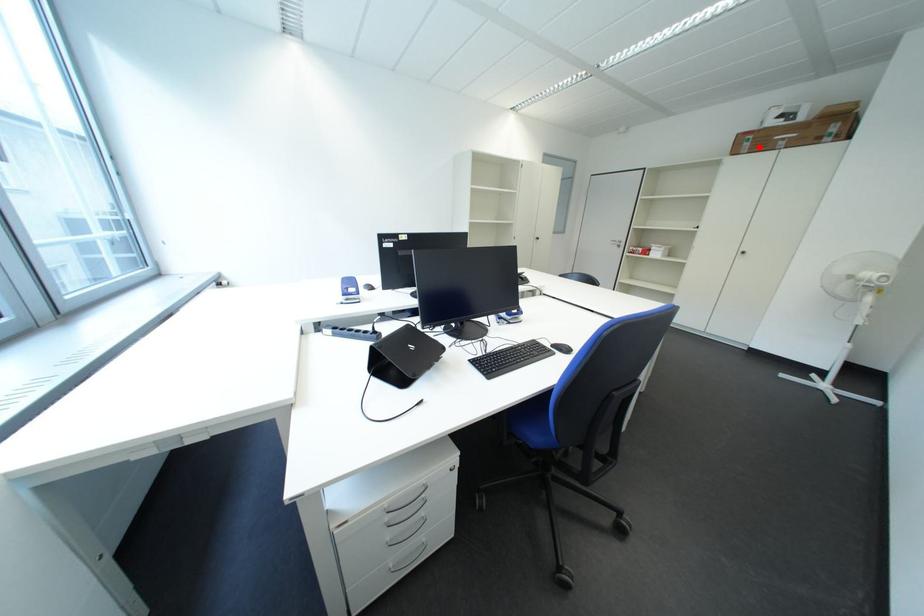
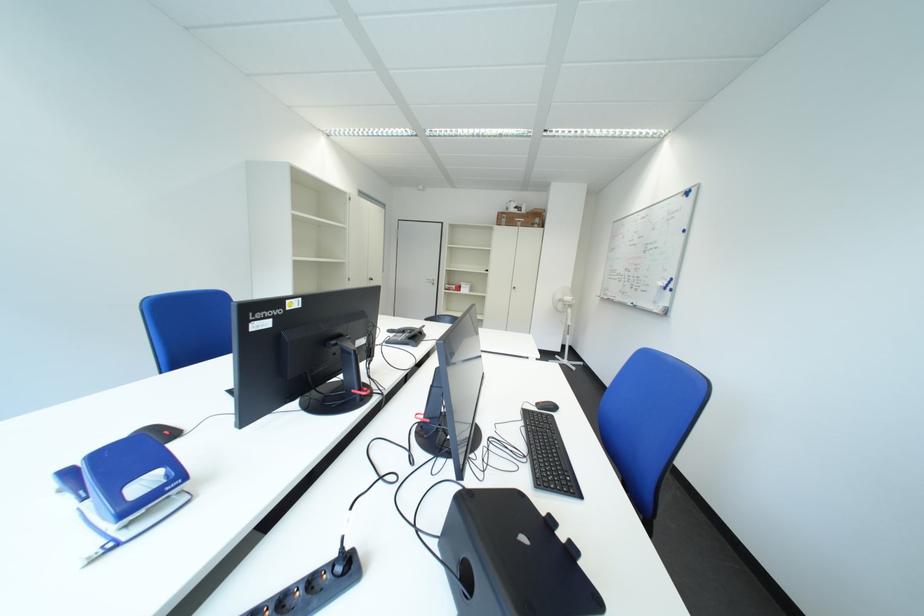
Question: I am providing you with two images of the same scene from different viewpoints. Image1 has a red point marked. In image2, the corresponding 3D location appears at what relative position? Reply with the corresponding letter.

Choices:
 (A) Closer
 (B) Farther

Answer: (A)